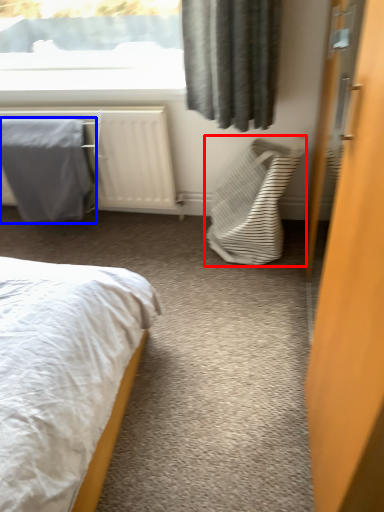
Question: Which of the following is the closest to the observer, laundry basket (highlighted by a red box) or blanket (highlighted by a blue box)?

Choices:
 (A) laundry basket
 (B) blanket

Answer: (A)